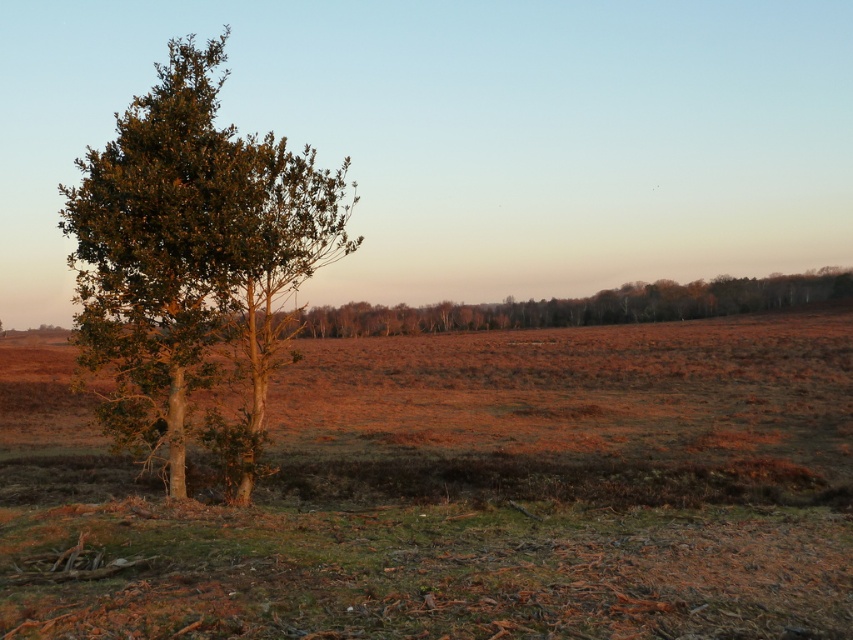
Can you confirm if brown grass at left is wider than green leafy tree at left?

Yes, brown grass at left is wider than green leafy tree at left.

Between brown grass at left and green leafy tree at left, which one is positioned higher?

Positioned higher is green leafy tree at left.

Who is more forward, (705, 584) or (194, 300)?

Point (705, 584)

Locate an element on the screen. The image size is (853, 640). brown grass at left is located at coordinates (463, 492).